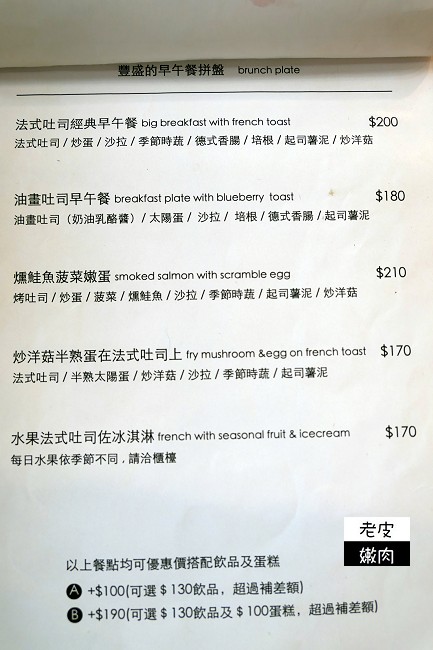
The image size is (433, 650). What are the coordinates of `stains` in the screenshot? It's located at (x=331, y=192), (x=59, y=161).